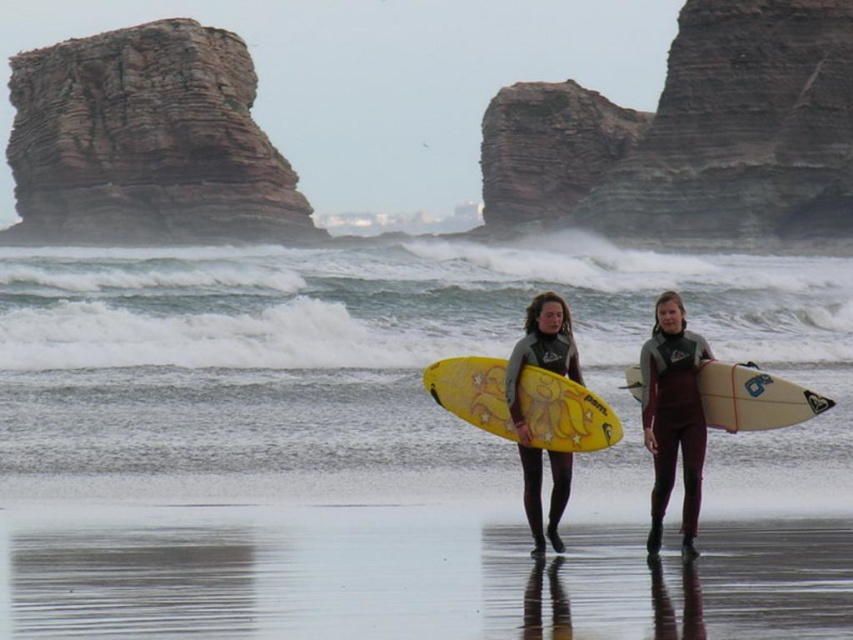
You are a photographer trying to capture the two surfers on the beach. You notice the gray matte wetsuit at center and the yellow matte surfboard at center. Which object should you focus on if you want to capture the larger one in your shot?

The gray matte wetsuit at center is bigger than the yellow matte surfboard at center, so you should focus on the gray matte wetsuit at center to capture the larger object.

You are a photographer positioned at the origin point of the coordinate system. You want to capture a photo of the gray matte wetsuit at center. What are the coordinates where you should aim your camera?

The gray matte wetsuit at center is located at point (x=675, y=420), so you should aim your camera at those coordinates to capture it.

You are standing on the beach and see two points marked on the sand. The first point is at coordinates point (709, 51) and the second is at point (555, 458). Which point is closer to the ocean?

Point (555, 458) is closer to the ocean because it is in front of point (709, 51), which is behind it.